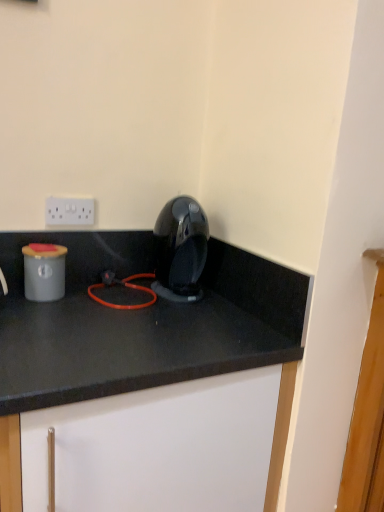
Question: Considering the positions of white plastic electric outlet at upper center and glossy plastic coffee machine at center in the image, is white plastic electric outlet at upper center wider or thinner than glossy plastic coffee machine at center?

Choices:
 (A) thin
 (B) wide

Answer: (A)

Question: Considering the positions of point (59, 221) and point (190, 257), is point (59, 221) closer or farther from the camera than point (190, 257)?

Choices:
 (A) farther
 (B) closer

Answer: (B)

Question: Which is farther from the matte gray container at left?

Choices:
 (A) glossy plastic coffee machine at center
 (B) white matte cabinet at center
 (C) white plastic electric outlet at upper center

Answer: (A)

Question: Which is nearer to the glossy plastic coffee machine at center?

Choices:
 (A) white plastic electric outlet at upper center
 (B) matte gray container at left
 (C) white matte cabinet at center

Answer: (C)